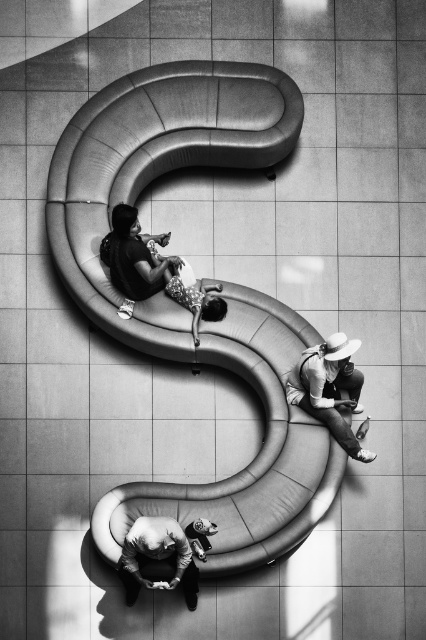
You are standing in the room and want to pick up the matte black dress at center and the matte white hat at lower right. Which item will you reach first if you move straight toward the sofa?

The matte black dress at center will be reached first because it is closer to you than the matte white hat at lower right.

Looking at this image, you are organizing a fashion show and need to display the matte black dress at center and the smooth leather jacket at lower center on a mannequin. Which item requires a larger mannequin to fit properly?

The matte black dress at center requires a larger mannequin because it has a larger size compared to the smooth leather jacket at lower center.